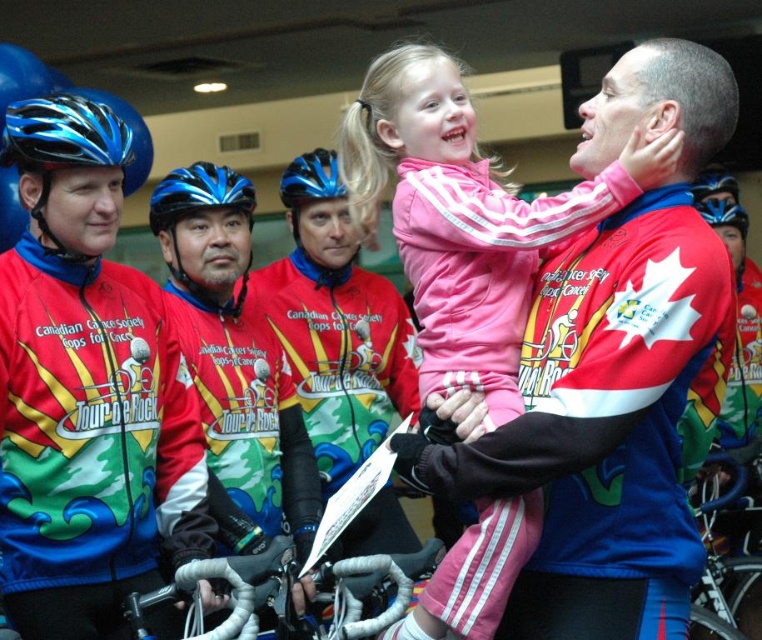
Question: Estimate the real-world distances between objects in this image. Which object is farther from the blue matte bicycle helmet at center?

Choices:
 (A) blue matte helmet at upper center
 (B) red and white jersey at left

Answer: (B)

Question: Which object is positioned closest to the pink fleece jacket at center?

Choices:
 (A) blue glossy bicycle helmet at center
 (B) blue matte helmet at upper center

Answer: (A)

Question: Does blue matte helmet at center have a lesser width compared to blue glossy bicycle helmet at left?

Choices:
 (A) yes
 (B) no

Answer: (B)

Question: Does blue glossy bicycle helmet at left appear on the left side of blue glossy bicycle helmet at center?

Choices:
 (A) yes
 (B) no

Answer: (A)

Question: Which object is farther from the camera taking this photo?

Choices:
 (A) blue matte helmet at center
 (B) blue glossy bicycle helmet at center
 (C) pink fleece jacket at center

Answer: (B)

Question: Is shiny blue helmet at upper left further to the viewer compared to blue matte helmet at upper center?

Choices:
 (A) no
 (B) yes

Answer: (A)